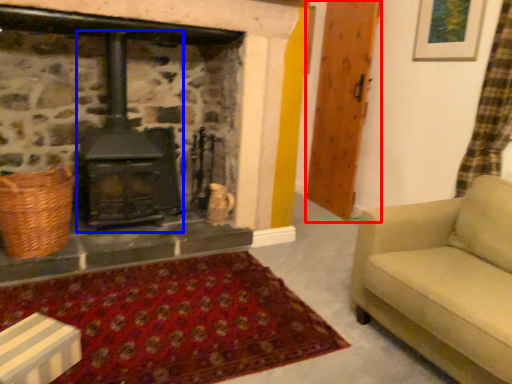
Question: Which object appears closest to the camera in this image, wood (highlighted by a red box) or wood burning stove (highlighted by a blue box)?

Choices:
 (A) wood
 (B) wood burning stove

Answer: (B)